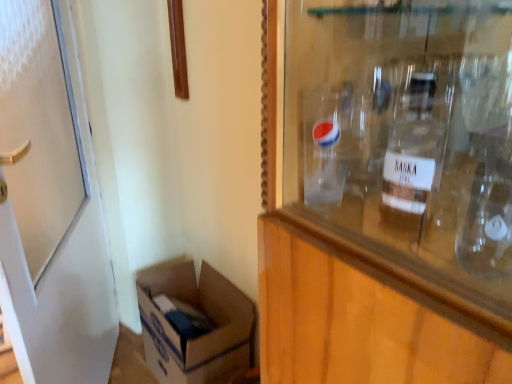
This screenshot has height=384, width=512. Describe the element at coordinates (50, 205) in the screenshot. I see `white matte door at left` at that location.

This screenshot has width=512, height=384. What are the coordinates of `white cardboard box at lower left` in the screenshot? It's located at (200, 336).

Locate an element on the screen. clear glass bottle at upper right is located at coordinates pos(413,155).

The height and width of the screenshot is (384, 512). I want to click on door that is behind the clear glass bottle at upper right, so click(50, 205).

From the image's perspective, between white matte door at left and clear glass bottle at upper right, who is located below?

white matte door at left, from the image's perspective.

Is white matte door at left inside the boundaries of clear glass bottle at upper right, or outside?

white matte door at left is not inside clear glass bottle at upper right, it's outside.

Measure the distance between white matte door at left and clear glass bottle at upper right.

1.09 meters.

Which is behind, point (185, 268) or point (414, 236)?

The point (185, 268) is behind.

Measure the distance between white cardboard box at lower left and clear glass bottle at upper right.

They are 3.86 feet apart.

In the scene shown: Between white cardboard box at lower left and clear glass bottle at upper right, which one has less height?

With less height is clear glass bottle at upper right.

Does white cardboard box at lower left have a greater width compared to clear glass bottle at upper right?

Indeed, white cardboard box at lower left has a greater width compared to clear glass bottle at upper right.

Where is `door below the clear glass bottle at upper right (from the image's perspective)`? The image size is (512, 384). door below the clear glass bottle at upper right (from the image's perspective) is located at coordinates (50, 205).

Looking at this image, is clear glass bottle at upper right placed right next to white matte door at left?

No, clear glass bottle at upper right is not beside white matte door at left.

Considering the points (424, 165) and (18, 182), which point is in front, point (424, 165) or point (18, 182)?

The point (424, 165) is closer.

Is clear glass bottle at upper right turned away from white matte door at left?

clear glass bottle at upper right is not turned away from white matte door at left.

Considering their positions, is clear glass bottle at upper right located in front of or behind white cardboard box at lower left?

clear glass bottle at upper right is in front of white cardboard box at lower left.

Based on the photo, from the image's perspective, is clear glass bottle at upper right on top of white cardboard box at lower left?

Yes, from the image's perspective, clear glass bottle at upper right is over white cardboard box at lower left.

Would you say clear glass bottle at upper right is inside or outside white cardboard box at lower left?

The correct answer is: outside.

Looking at this image, can you confirm if clear glass bottle at upper right is bigger than white cardboard box at lower left?

Actually, clear glass bottle at upper right might be smaller than white cardboard box at lower left.

Considering the sizes of white matte door at left and white cardboard box at lower left in the image, is white matte door at left bigger or smaller than white cardboard box at lower left?

Clearly, white matte door at left is larger in size than white cardboard box at lower left.

How many degrees apart are the facing directions of white matte door at left and white cardboard box at lower left?

white matte door at left and white cardboard box at lower left are facing 30.3 degrees away from each other.

This screenshot has width=512, height=384. In order to click on box below the white matte door at left (from the image's perspective) in this screenshot , I will do `click(200, 336)`.

Considering the sizes of white matte door at left and white cardboard box at lower left in the image, is white matte door at left wider or thinner than white cardboard box at lower left?

In the image, white matte door at left appears to be more narrow than white cardboard box at lower left.

Is white cardboard box at lower left not within white matte door at left?

Yes, white cardboard box at lower left is not within white matte door at left.

How much distance is there between white cardboard box at lower left and white matte door at left?

white cardboard box at lower left is 42.80 centimeters away from white matte door at left.

Is white cardboard box at lower left further to camera compared to white matte door at left?

Yes.

In order to click on door that appears behind the clear glass bottle at upper right in this screenshot , I will do `click(50, 205)`.

Identify the location of box lying on the left of clear glass bottle at upper right. The width and height of the screenshot is (512, 384). (200, 336).

Looking at the image, which one is located further to white matte door at left, clear glass bottle at upper right or white cardboard box at lower left?

clear glass bottle at upper right is positioned further to the anchor white matte door at left.

When comparing their distances from white cardboard box at lower left, does white matte door at left or clear glass bottle at upper right seem closer?

Among the two, white matte door at left is located nearer to white cardboard box at lower left.

From the image, which object appears to be farther from white cardboard box at lower left, clear glass bottle at upper right or white matte door at left?

clear glass bottle at upper right.

When comparing their distances from clear glass bottle at upper right, does white matte door at left or white cardboard box at lower left seem further?

Among the two, white cardboard box at lower left is located further to clear glass bottle at upper right.

Based on their spatial positions, is white cardboard box at lower left or white matte door at left closer to clear glass bottle at upper right?

Among the two, white matte door at left is located nearer to clear glass bottle at upper right.

Estimate the real-world distances between objects in this image. Which object is further from white matte door at left, white cardboard box at lower left or clear glass bottle at upper right?

clear glass bottle at upper right is positioned further to the anchor white matte door at left.

Locate an element on the screen. door between clear glass bottle at upper right and white cardboard box at lower left along the z-axis is located at coordinates (50, 205).